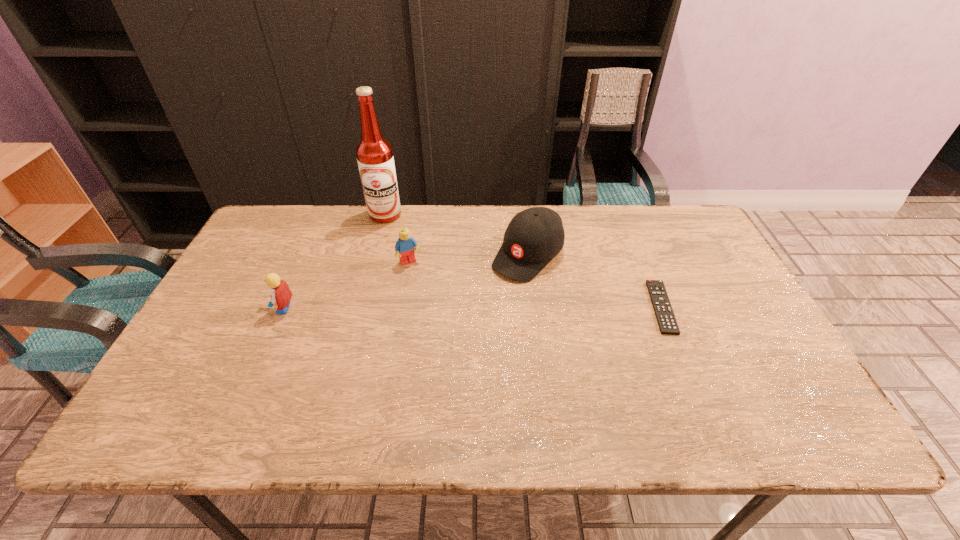
Locate an element on the screen. The image size is (960, 540). the left Lego is located at coordinates [280, 293].

This screenshot has height=540, width=960. I want to click on the nearer Lego, so tap(280, 293).

In order to click on the rightmost object in this screenshot , I will do (666, 320).

Locate an element on the screen. remote control is located at coordinates (666, 320).

The height and width of the screenshot is (540, 960). I want to click on the fourth object from left to right, so click(534, 236).

At what (x,y) coordinates should I click in order to perform the action: click on alcohol. Please return your answer as a coordinate pair (x, y). The height and width of the screenshot is (540, 960). Looking at the image, I should click on (374, 153).

Identify the location of the fourth object from right to left. (374, 153).

Identify the location of the third object from left to right. This screenshot has width=960, height=540. (404, 247).

Find the location of a particular element. the farther Lego is located at coordinates (404, 247).

Locate an element on the screen. This screenshot has height=540, width=960. free space located on the front-facing side of the leftmost object is located at coordinates (252, 308).